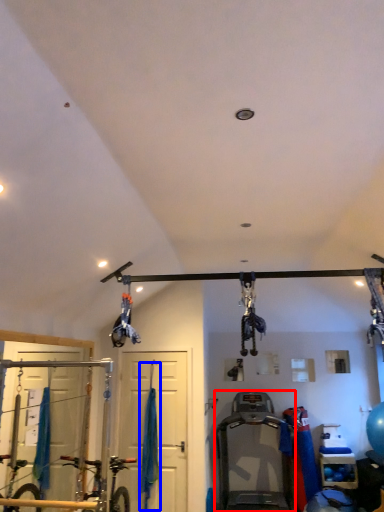
Question: Which object is closer to the camera taking this photo, treadmill (highlighted by a red box) or curtain (highlighted by a blue box)?

Choices:
 (A) treadmill
 (B) curtain

Answer: (A)